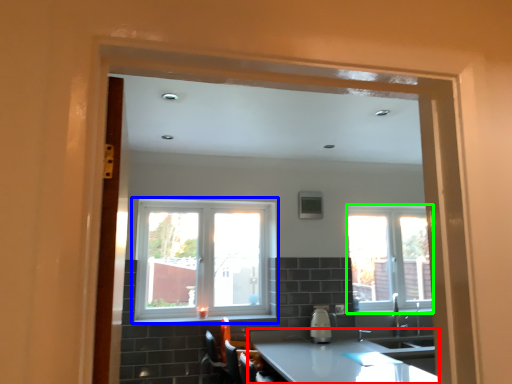
Question: Which object is the closest to the countertop (highlighted by a red box)? Choose among these: window (highlighted by a blue box) or window (highlighted by a green box).

Choices:
 (A) window
 (B) window

Answer: (B)